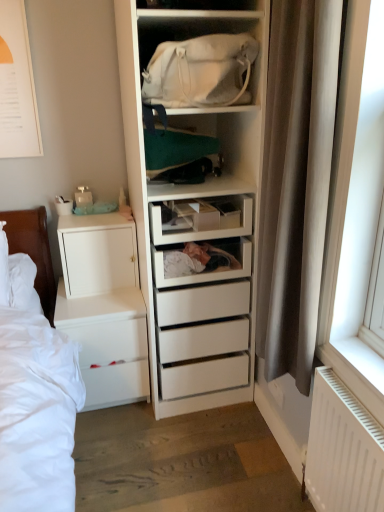
Image resolution: width=384 pixels, height=512 pixels. Find the location of `white paper at upper left`. white paper at upper left is located at coordinates pos(17,86).

In order to face brown fabric curtain at right, should I rotate leftwards or rightwards?

Turn right approximately 12.012 degrees to face it.

What do you see at coordinates (343, 449) in the screenshot?
I see `white plastic radiator at lower right` at bounding box center [343, 449].

Measure the distance between point (132, 294) and camera.

The depth of point (132, 294) is 6.77 feet.

Where is `white fabric bag at upper center`? The width and height of the screenshot is (384, 512). white fabric bag at upper center is located at coordinates (201, 71).

Consider the image. Who is bigger, white paper at upper left or white fabric bag at upper center?

white fabric bag at upper center.

From a real-world perspective, is white paper at upper left located higher than white fabric bag at upper center?

Yes, from a real-world perspective, white paper at upper left is on top of white fabric bag at upper center.

Are white paper at upper left and white fabric bag at upper center making contact?

No, white paper at upper left is not beside white fabric bag at upper center.

Does white paper at upper left have a larger size compared to brown fabric curtain at right?

Actually, white paper at upper left might be smaller than brown fabric curtain at right.

From the picture: From a real-world perspective, is white paper at upper left positioned under brown fabric curtain at right based on gravity?

No, from a real-world perspective, white paper at upper left is not beneath brown fabric curtain at right.

Is white paper at upper left oriented away from brown fabric curtain at right?

No.

From the image's perspective, is white paper at upper left located beneath brown fabric curtain at right?

No, from the image's perspective, white paper at upper left is not below brown fabric curtain at right.

Is white plastic radiator at lower right positioned beyond the bounds of white matte cabinet at left?

That's correct, white plastic radiator at lower right is outside of white matte cabinet at left.

Are white plastic radiator at lower right and white matte cabinet at left beside each other?

No, white plastic radiator at lower right is not beside white matte cabinet at left.

Consider the image. From a real-world perspective, is white plastic radiator at lower right located higher than white matte cabinet at left?

Actually, white plastic radiator at lower right is physically below white matte cabinet at left in the real world.

In the image, is white plastic radiator at lower right on the left side or the right side of white matte cabinet at left?

In the image, white plastic radiator at lower right appears on the right side of white matte cabinet at left.

In the scene shown: How much distance is there between white matte cabinet at left and white plastic radiator at lower right?

white matte cabinet at left is 1.13 meters away from white plastic radiator at lower right.

In the scene shown: Can you see white matte cabinet at left touching white plastic radiator at lower right?

white matte cabinet at left and white plastic radiator at lower right are clearly separated.

Can we say white matte cabinet at left lies outside white plastic radiator at lower right?

Absolutely, white matte cabinet at left is external to white plastic radiator at lower right.

You are a GUI agent. You are given a task and a screenshot of the screen. Output one action in this format:
    pyautogui.click(x=<x>, y=<y>)
    Task: Click on the cabinetry to the left of white plastic radiator at lower right
    This screenshot has height=512, width=384.
    Given the screenshot: What is the action you would take?
    pyautogui.click(x=97, y=254)

Between white plastic radiator at lower right and white matte chest of drawers at lower left, which one has larger size?

With larger size is white matte chest of drawers at lower left.

Is white plastic radiator at lower right taller or shorter than white matte chest of drawers at lower left?

Clearly, white plastic radiator at lower right is taller compared to white matte chest of drawers at lower left.

Is white plastic radiator at lower right in front of white matte chest of drawers at lower left?

Yes, the depth of white plastic radiator at lower right is less than that of white matte chest of drawers at lower left.

Between white matte cabinet at left and white plastic drawer at center, which one has smaller width?

With smaller width is white matte cabinet at left.

Based on their positions, is white matte cabinet at left located to the left or right of white plastic drawer at center?

From the image, it's evident that white matte cabinet at left is to the left of white plastic drawer at center.

From a real-world perspective, is white matte cabinet at left physically below white plastic drawer at center?

Yes, from a real-world perspective, white matte cabinet at left is beneath white plastic drawer at center.

Is white matte chest of drawers at lower left thinner than white paper at upper left?

No, white matte chest of drawers at lower left is not thinner than white paper at upper left.

Considering the points (146, 394) and (15, 91), which point is in front, point (146, 394) or point (15, 91)?

The point (15, 91) is in front.

Can you tell me how much white matte chest of drawers at lower left and white paper at upper left differ in facing direction?

The angle between the facing direction of white matte chest of drawers at lower left and the facing direction of white paper at upper left is 0.268 degrees.

Which is behind, white matte chest of drawers at lower left or white paper at upper left?

white matte chest of drawers at lower left is further away from the camera.

Locate an element on the screen. This screenshot has width=384, height=512. bag in front of the white paper at upper left is located at coordinates (201, 71).

You are a GUI agent. You are given a task and a screenshot of the screen. Output one action in this format:
    pyautogui.click(x=<x>, y=<y>)
    Task: Click on the curtain on the right side of white paper at upper left
    
    Given the screenshot: What is the action you would take?
    pyautogui.click(x=296, y=182)

From the picture: When comparing their distances from white plastic radiator at lower right, does white fabric bag at upper center or white paper at upper left seem closer?

white fabric bag at upper center.

Looking at the image, which one is located closer to white matte cabinet at left, white matte chest of drawers at lower left or white paper at upper left?

Based on the image, white matte chest of drawers at lower left appears to be nearer to white matte cabinet at left.

Which object lies further to the anchor point white matte chest of drawers at lower left, white plastic radiator at lower right or white matte cabinet at left?

white plastic radiator at lower right is further to white matte chest of drawers at lower left.

Which object lies further to the anchor point white plastic radiator at lower right, brown fabric curtain at right or white matte chest of drawers at lower left?

white matte chest of drawers at lower left is further to white plastic radiator at lower right.

Based on their spatial positions, is white fabric bag at upper center or white plastic drawer at center closer to white plastic radiator at lower right?

white plastic drawer at center is closer to white plastic radiator at lower right.

Looking at the image, which one is located closer to white matte chest of drawers at lower left, white paper at upper left or white fabric bag at upper center?

white paper at upper left.

In the scene shown: When comparing their distances from white plastic drawer at center, does brown fabric curtain at right or white fabric bag at upper center seem further?

white fabric bag at upper center is positioned further to the anchor white plastic drawer at center.

From the image, which object appears to be farther from white plastic radiator at lower right, white matte cabinet at left or white paper at upper left?

white paper at upper left.

This screenshot has height=512, width=384. Find the location of `curtain between white matte chest of drawers at lower left and white plastic radiator at lower right`. curtain between white matte chest of drawers at lower left and white plastic radiator at lower right is located at coordinates (296, 182).

Find the location of `chest of drawers between white plastic drawer at center and white plastic radiator at lower right from top to bottom`. chest of drawers between white plastic drawer at center and white plastic radiator at lower right from top to bottom is located at coordinates (104, 307).

Where is `curtain between white plastic drawer at center and white plastic radiator at lower right in the up-down direction`? curtain between white plastic drawer at center and white plastic radiator at lower right in the up-down direction is located at coordinates (296, 182).

This screenshot has height=512, width=384. In order to click on drawer that lies between white paper at upper left and white plastic radiator at lower right from top to bottom in this screenshot , I will do `click(200, 231)`.